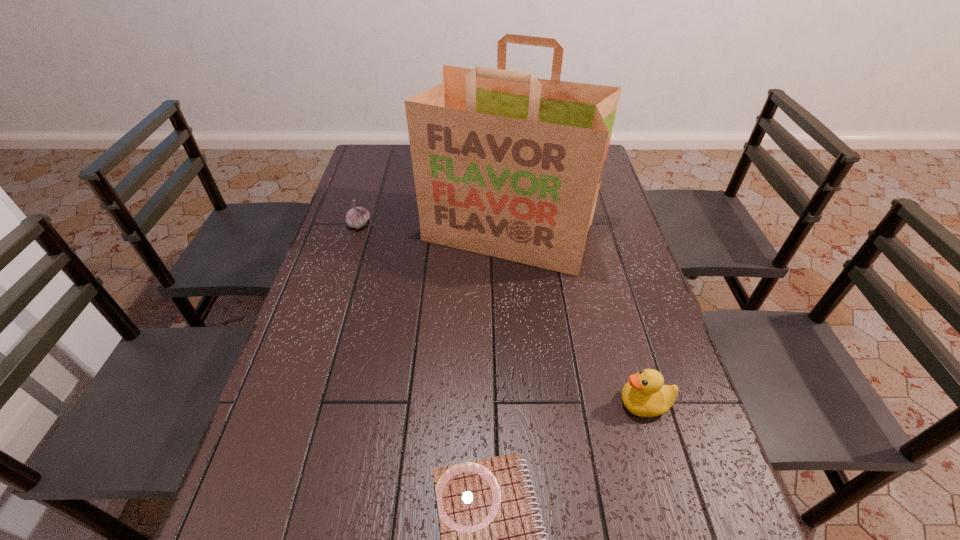
The image size is (960, 540). Identify the location of object present at the left edge. (357, 217).

At what (x,y) coordinates should I click in order to perform the action: click on grocery bag that is positioned at the right edge. Please return your answer as a coordinate pair (x, y). Looking at the image, I should click on (507, 165).

The height and width of the screenshot is (540, 960). What are the coordinates of `duck present at the right edge` in the screenshot? It's located at (645, 395).

In order to click on free space at the left edge of the desktop in this screenshot , I will do `click(377, 215)`.

Where is `free location at the right edge`? Image resolution: width=960 pixels, height=540 pixels. free location at the right edge is located at coordinates (597, 231).

I want to click on empty space that is in between the third shortest object and the leftmost object, so click(502, 314).

Image resolution: width=960 pixels, height=540 pixels. In order to click on vacant space that is in between the duck and the tallest object in this screenshot , I will do `click(576, 318)`.

This screenshot has height=540, width=960. In order to click on empty location between the grocery bag and the second nearest object in this screenshot , I will do `click(576, 318)`.

The image size is (960, 540). I want to click on free space between the grocery bag and the third shortest object, so click(x=576, y=318).

Find the location of a particular element. free space between the duck and the leftmost object is located at coordinates (502, 314).